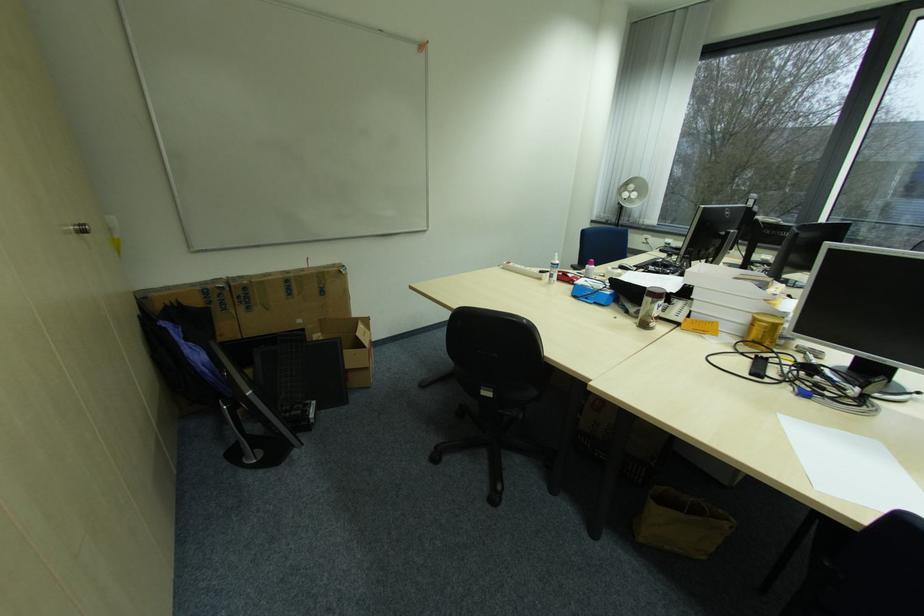
I want to click on white paper tray, so click(852, 467).